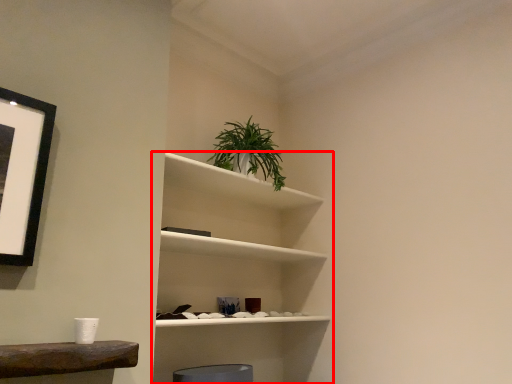
Question: Observing the image, what is the correct spatial positioning of shelf (annotated by the red box) in reference to houseplant?

Choices:
 (A) left
 (B) right

Answer: (A)